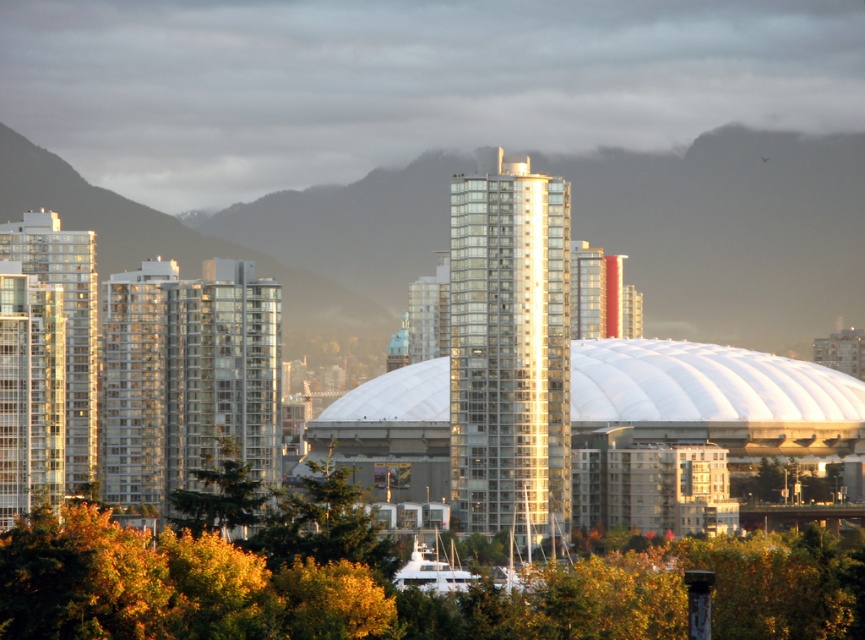
You are standing in the city park and see the glassy reflective building at left and the green leafy tree at center. Which object is positioned more to the east if the sun is setting in the west?

The glassy reflective building at left is positioned more to the east because it is to the left of the green leafy tree at center, and since the sun is setting in the west, the left side of the image would correspond to the east direction.

You are standing in the city park and want to take a photo of the glassy reflective building at left without any obstructions. Since the green leafy tree at lower left is blocking the view, can you move to a position where the tree is no longer in the way?

The glassy reflective building at left is located above the green leafy tree at lower left. If you move to a position where you can look upward past the tree, you can capture the building without obstruction.

You are standing at the point with coordinates point [258,486] and want to walk to the point with coordinates point [85,419]. Will you be moving towards the white dome structure in the cityscape?

Yes, moving from point [258,486] to point [85,419] means you are moving towards the white dome structure because point [85,419] is behind point [258,486], implying it is closer to the dome.